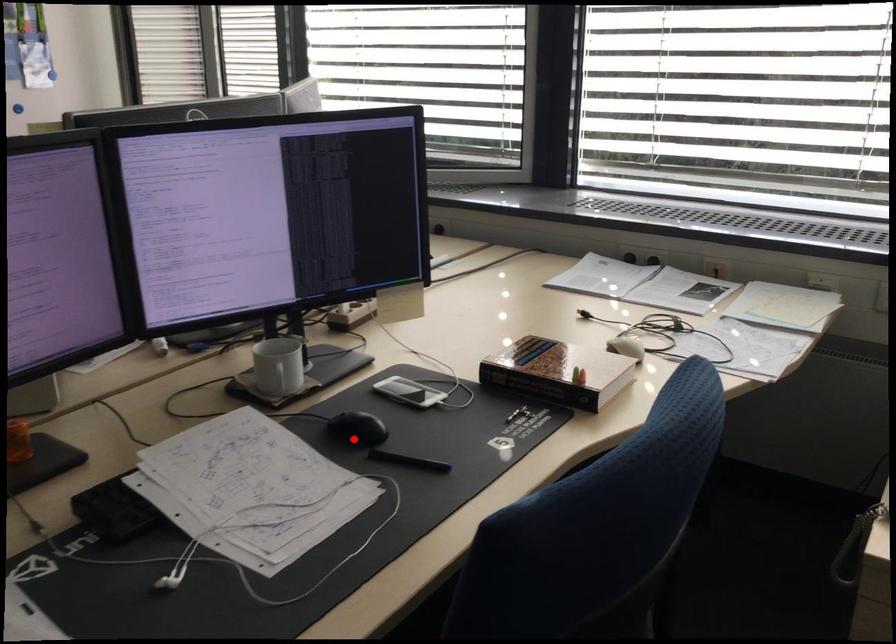
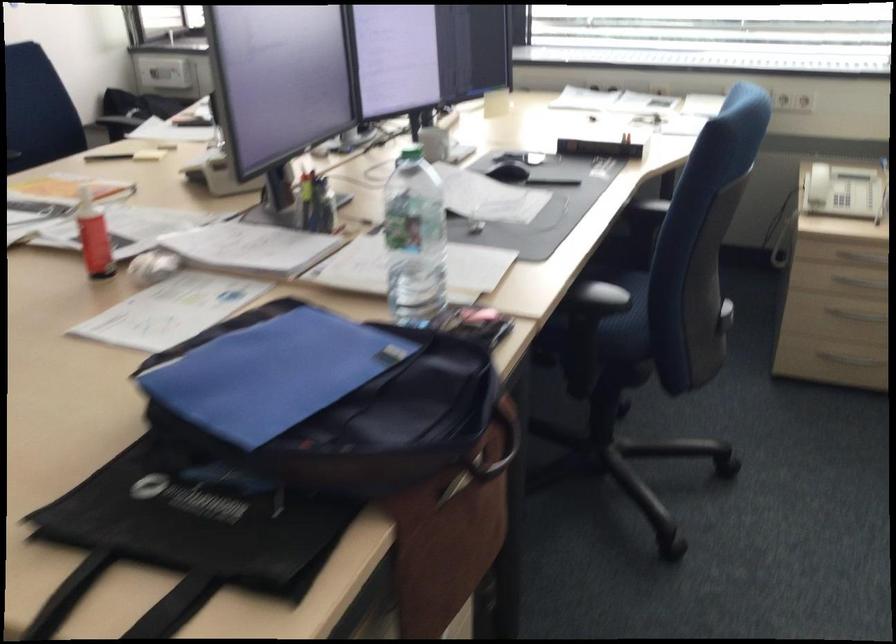
Question: I am providing you with two images of the same scene from different viewpoints. Given a red point in image1, look at the same physical point in image2. Is it:

Choices:
 (A) Closer to the viewpoint
 (B) Farther from the viewpoint

Answer: (B)